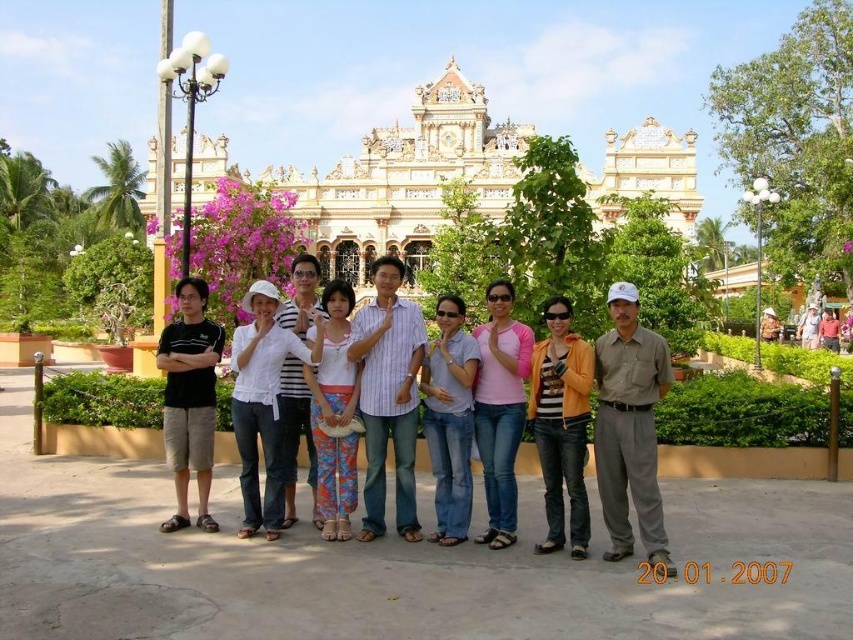
Question: Which point is farther to the camera?

Choices:
 (A) orange denim jacket at center
 (B) striped cotton shirt at center
 (C) black cotton shirt at left
 (D) denim jeans at center

Answer: (B)

Question: Can you confirm if striped cotton shirt at center is bigger than pink cotton shirt at center?

Choices:
 (A) no
 (B) yes

Answer: (B)

Question: Does striped cotton shirt at center have a larger size compared to printed cotton dress at center?

Choices:
 (A) yes
 (B) no

Answer: (A)

Question: Is white cotton shirt at center positioned behind denim jeans at center?

Choices:
 (A) yes
 (B) no

Answer: (A)

Question: Which point is closer to the camera?

Choices:
 (A) (321, 412)
 (B) (413, 196)

Answer: (A)

Question: Which of the following is the farthest from the observer?

Choices:
 (A) golden ornate palace at center
 (B) black cotton shirt at left
 (C) orange denim jacket at center

Answer: (A)